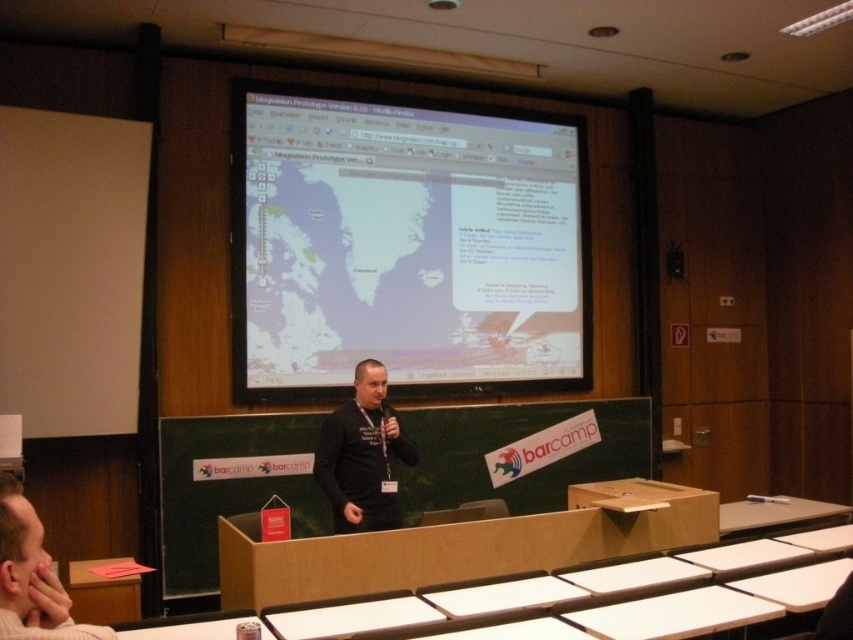
Is black matte shirt at center above dark gray shirt at center?

Incorrect, black matte shirt at center is not positioned above dark gray shirt at center.

Describe the element at coordinates (363, 456) in the screenshot. This screenshot has width=853, height=640. I see `black matte shirt at center` at that location.

Between point (323, 492) and point (27, 634), which one is positioned in front?

Point (27, 634) is in front.

Locate an element on the screen. The image size is (853, 640). black matte shirt at center is located at coordinates (363, 456).

Can you confirm if matte black projector screen at upper center is positioned below dark gray shirt at center?

No.

Consider the image. Can you confirm if matte black projector screen at upper center is wider than dark gray shirt at center?

Yes, matte black projector screen at upper center is wider than dark gray shirt at center.

Is point (376, 182) farther from viewer compared to point (7, 600)?

Yes, it is.

Locate an element on the screen. matte black projector screen at upper center is located at coordinates (405, 244).

Is matte black projector screen at upper center further to the viewer compared to black matte shirt at center?

Yes.

Does point (357, 269) come behind point (318, 477)?

Yes.

Where is `matte black projector screen at upper center`? matte black projector screen at upper center is located at coordinates (405, 244).